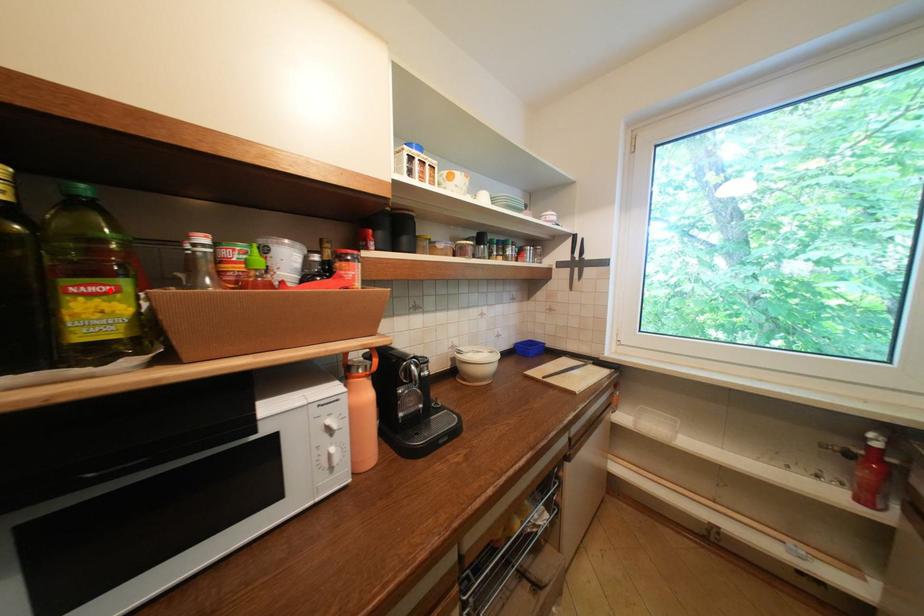
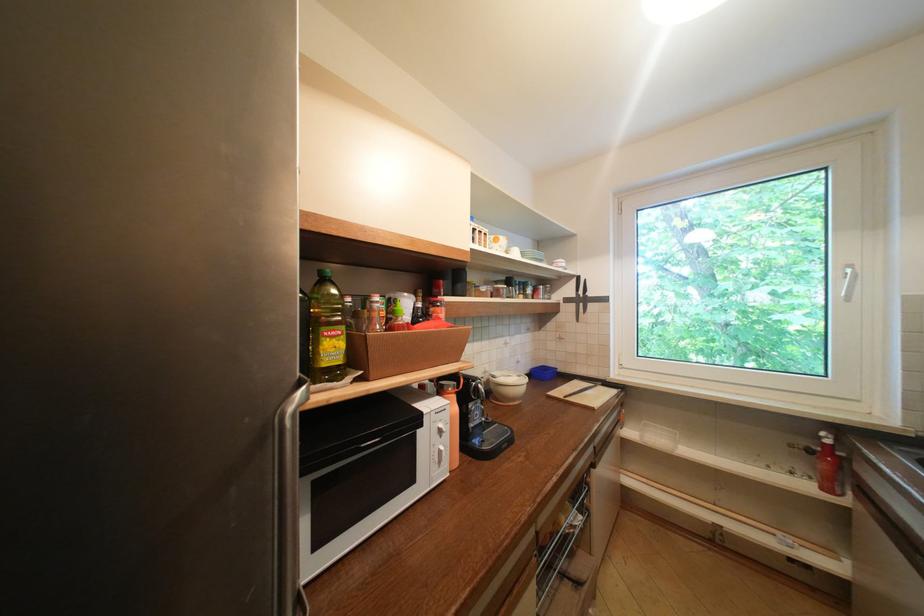
The point at the highlighted location is marked in the first image. Where is the corresponding point in the second image?

(345, 334)